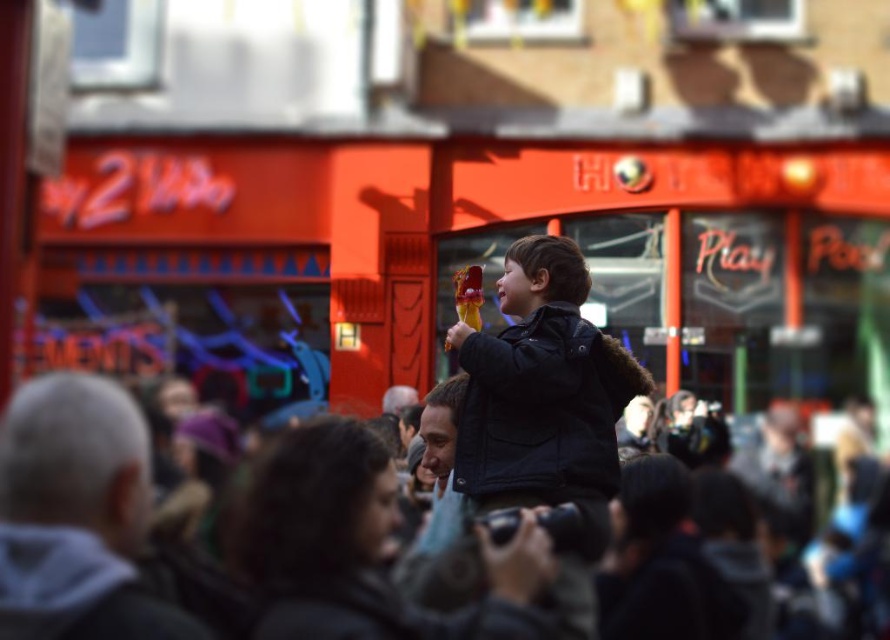
You are a fashion designer observing the lively street scene. You notice the dark brown leather jacket at center and the gray woolen hat at left. Which object is bigger in size?

The dark brown leather jacket at center is larger in size compared to the gray woolen hat at left.

You are a photographer trying to capture a candid shot of the dark brown hair at center without including the dark brown leather jacket at center in the frame. Is this possible based on their current positions?

The dark brown leather jacket at center is positioned over dark brown hair at center, so it would be difficult to capture the dark brown hair at center without including the jacket in the frame.

You are a tailor who needs to measure two items in the scene for alterations. You see the dark brown leather jacket at center and the dark brown hair at center. Which item is larger in size?

The dark brown leather jacket at center is bigger than dark brown hair at center, so the jacket is larger in size.